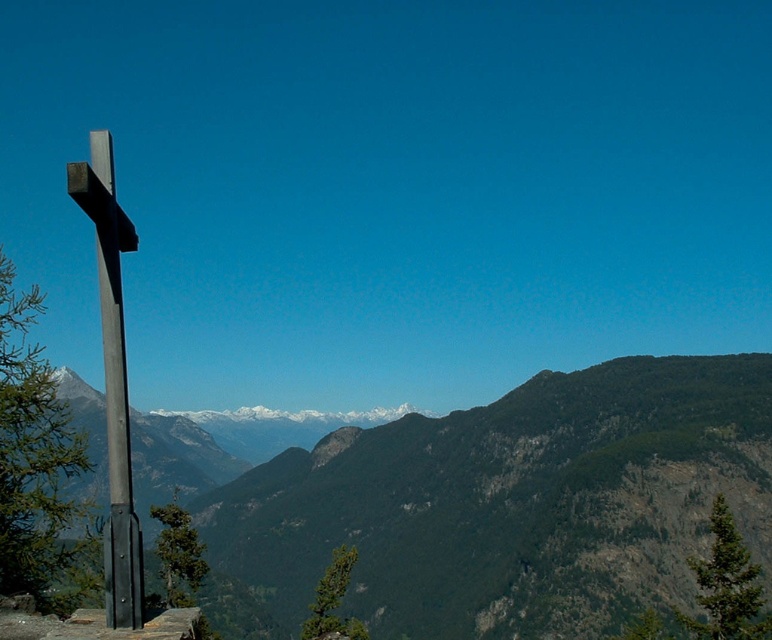
You are a hiker who wants to take a photo of both the green textured mountain range at center and the black metal cross at left. Which object should you focus on first to ensure both are in the frame?

The green textured mountain range at center is bigger than the black metal cross at left, so you should focus on the black metal cross at left first to ensure both are in the frame.

You are a hiker who wants to take a photo of both the green textured mountain range at center and the black metal cross at left. Which object should you focus on first if you want to include both in your frame without moving the camera?

You should focus on the green textured mountain range at center first because it is wider than the black metal cross at left, so it will take up more space in the frame.

You are standing in the mountain landscape and want to walk towards the green textured mountain range at center and the black metal cross at left. Which object will you reach first?

You will reach the black metal cross at left first because it is closer to you than the green textured mountain range at center, which is further away.